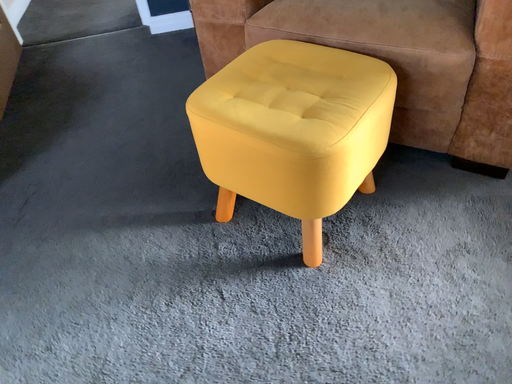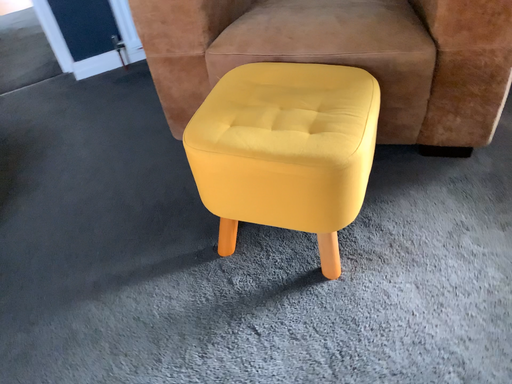
Question: Which way did the camera rotate in the video?

Choices:
 (A) rotated right
 (B) rotated left

Answer: (A)